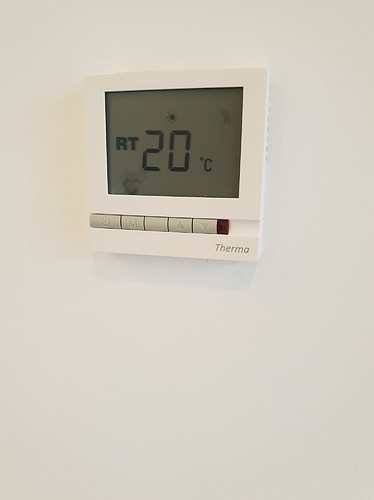
You are a GUI agent. You are given a task and a screenshot of the screen. Output one action in this format:
    pyautogui.click(x=<x>, y=<y>)
    Task: Click on the wall
    The image size is (374, 500).
    Given the screenshot: What is the action you would take?
    pyautogui.click(x=334, y=122)